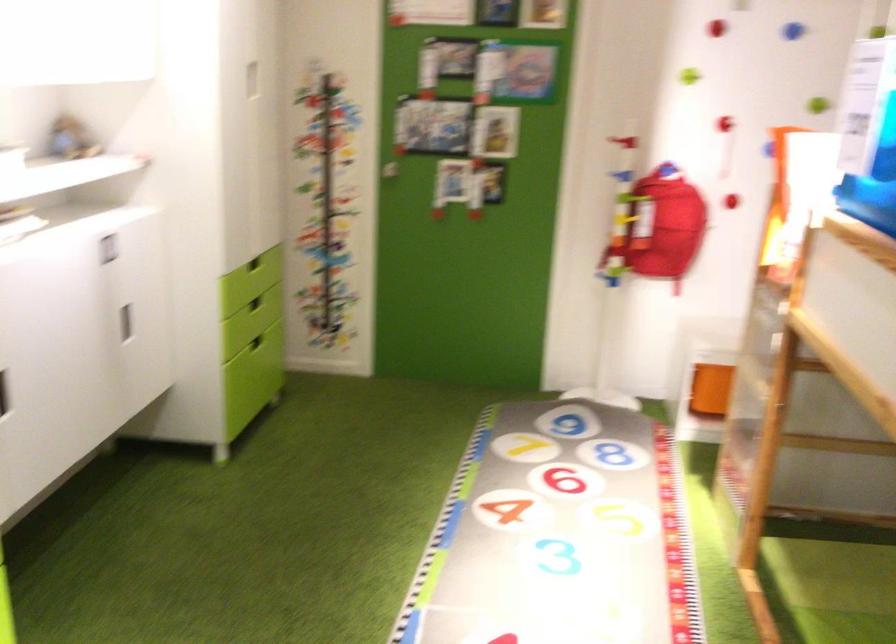
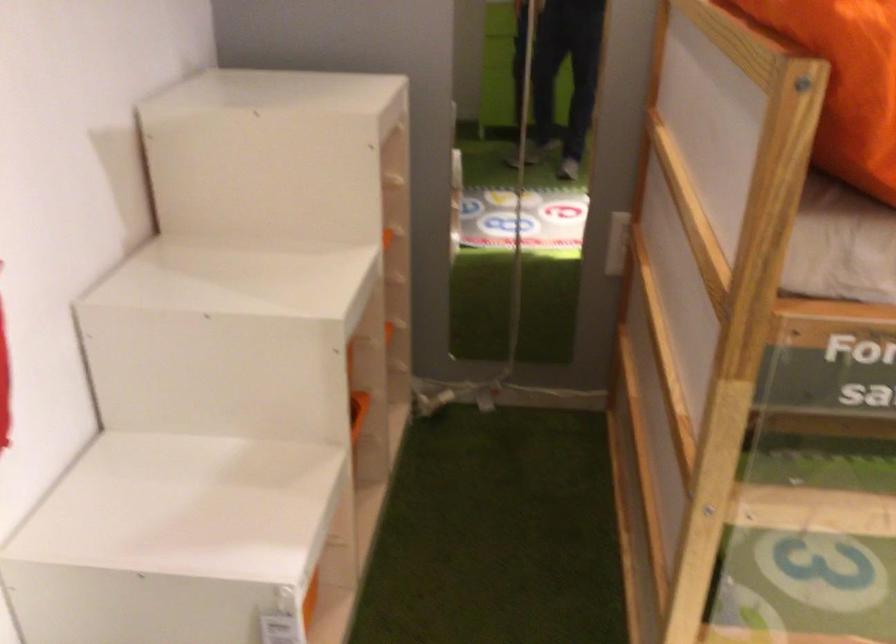
Where in the second image is the point corresponding to (719,406) from the first image?

(309, 600)